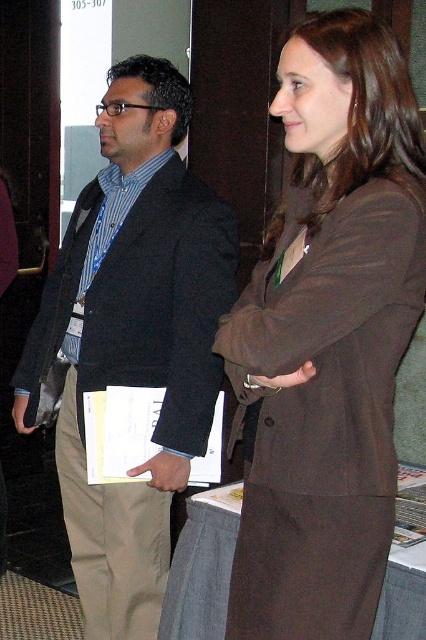
In the scene shown: Based on the scene description, where is the brown matte suit at center located in the image?

The brown matte suit at center is located at point 0.525 on the x axis and 0.772 on the y axis.